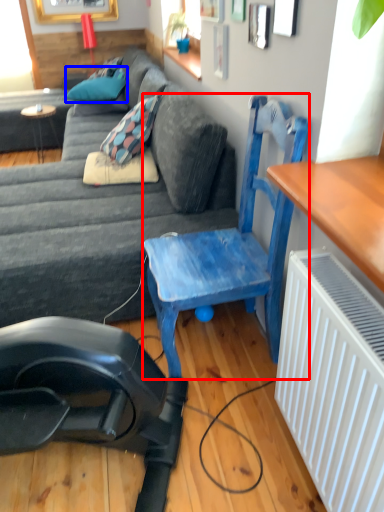
Question: Which of the following is the closest to the observer, chair (highlighted by a red box) or pillow (highlighted by a blue box)?

Choices:
 (A) chair
 (B) pillow

Answer: (A)